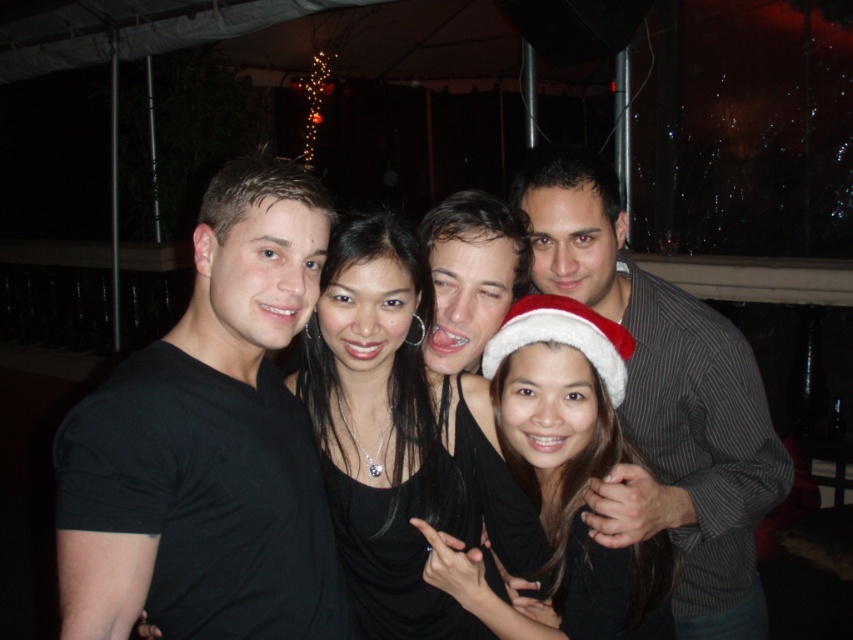
You are a photographer trying to adjust the lighting for a group photo. You notice the striped fabric shirt at right and the shiny metallic face at center. Which object is closer to the camera?

The striped fabric shirt at right is in front of the shiny metallic face at center, so it is closer to the camera.

You are a photographer trying to adjust the focus of your camera. You need to focus on the two points in the image, point (x=666, y=294) and point (x=454, y=200). Which point should you focus on first if you want to start with the one closer to the camera?

You should focus on point (x=666, y=294) first because it is closer to the camera compared to point (x=454, y=200) according to the description.